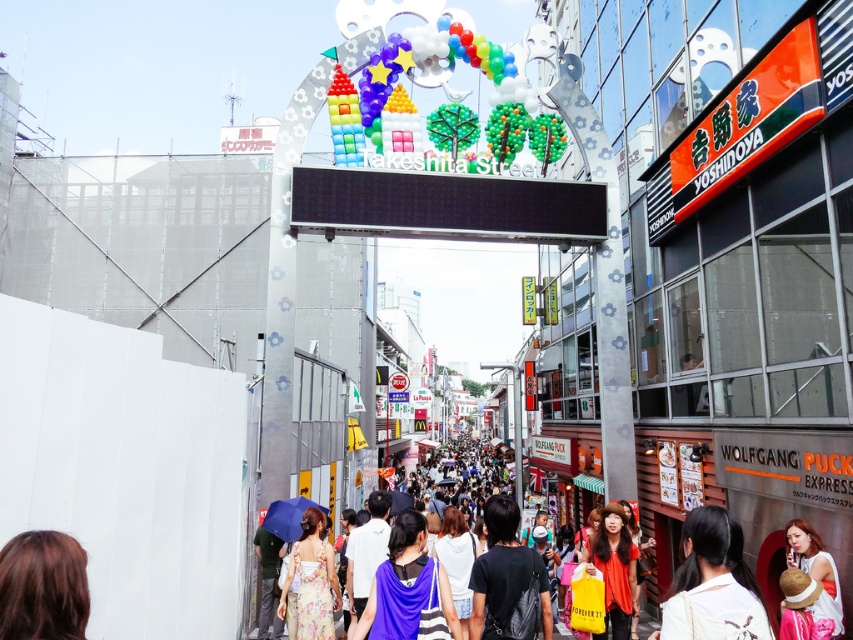
Question: Estimate the real-world distances between objects in this image. Which object is closer to the matte orange shirt at center?

Choices:
 (A) multicolored fabric crowd at center
 (B) purple fabric bag at center

Answer: (B)

Question: Which point is closer to the camera taking this photo?

Choices:
 (A) (328, 561)
 (B) (791, 532)

Answer: (B)

Question: Can you confirm if brown hair at lower left is bigger than floral fabric dress at lower center?

Choices:
 (A) yes
 (B) no

Answer: (A)

Question: Which object is closer to the camera taking this photo?

Choices:
 (A) purple fabric bag at center
 (B) multicolored fabric crowd at center

Answer: (B)

Question: Does purple fabric bag at center appear on the right side of black matte backpack at center?

Choices:
 (A) no
 (B) yes

Answer: (A)

Question: Is light brown hair at center behind floral fabric dress at lower center?

Choices:
 (A) yes
 (B) no

Answer: (B)